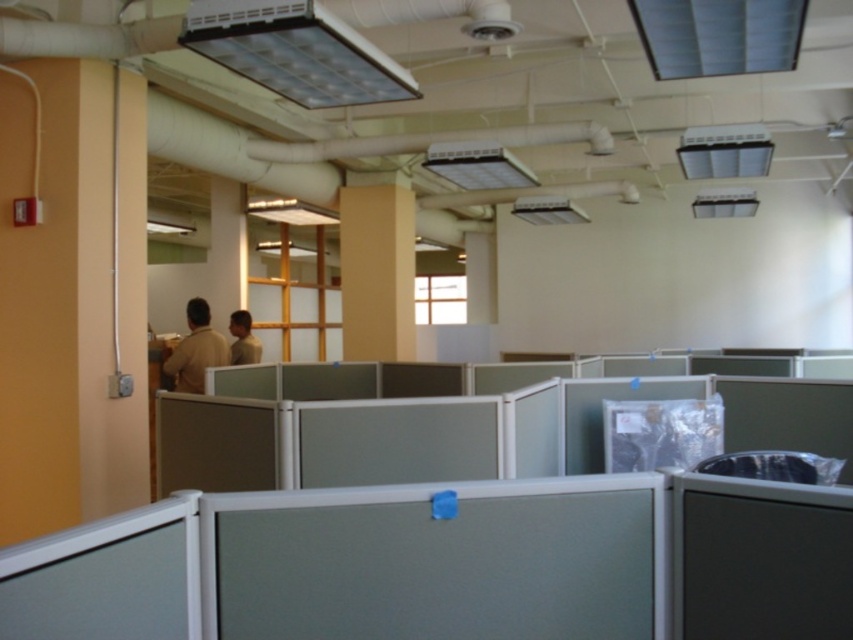
Is brown matte shirt at left positioned behind light brown shirt at center?

No.

Who is more distant from viewer, (x=189, y=346) or (x=231, y=333)?

Point (x=231, y=333)

Where is `brown matte shirt at left`? This screenshot has width=853, height=640. brown matte shirt at left is located at coordinates (196, 349).

Is matte wood pillar at center below brown matte shirt at left?

No.

Where is `matte wood pillar at center`? The width and height of the screenshot is (853, 640). matte wood pillar at center is located at coordinates (376, 266).

What are the coordinates of `matte wood pillar at center` in the screenshot? It's located at (376, 266).

Does matte wood pillar at upper center appear on the left side of light brown shirt at center?

Indeed, matte wood pillar at upper center is positioned on the left side of light brown shirt at center.

Is matte wood pillar at upper center wider than light brown shirt at center?

Yes.

Which is behind, point (231, 256) or point (239, 339)?

Positioned behind is point (231, 256).

Locate an element on the screen. matte wood pillar at upper center is located at coordinates (225, 252).